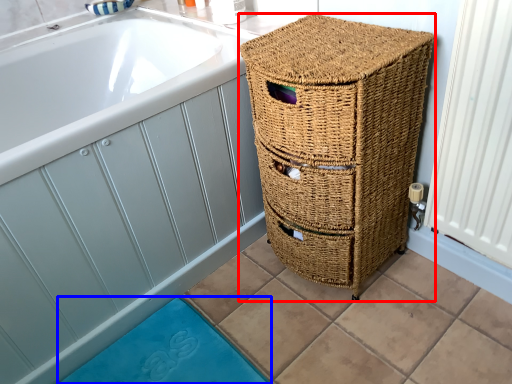
Question: Which object is closer to the camera taking this photo, furniture (highlighted by a red box) or bath mat (highlighted by a blue box)?

Choices:
 (A) furniture
 (B) bath mat

Answer: (A)